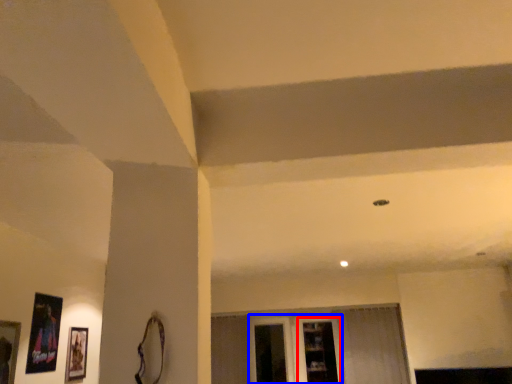
Question: Which of the following is the closest to the observer, shelf (highlighted by a red box) or glass door (highlighted by a blue box)?

Choices:
 (A) shelf
 (B) glass door

Answer: (A)